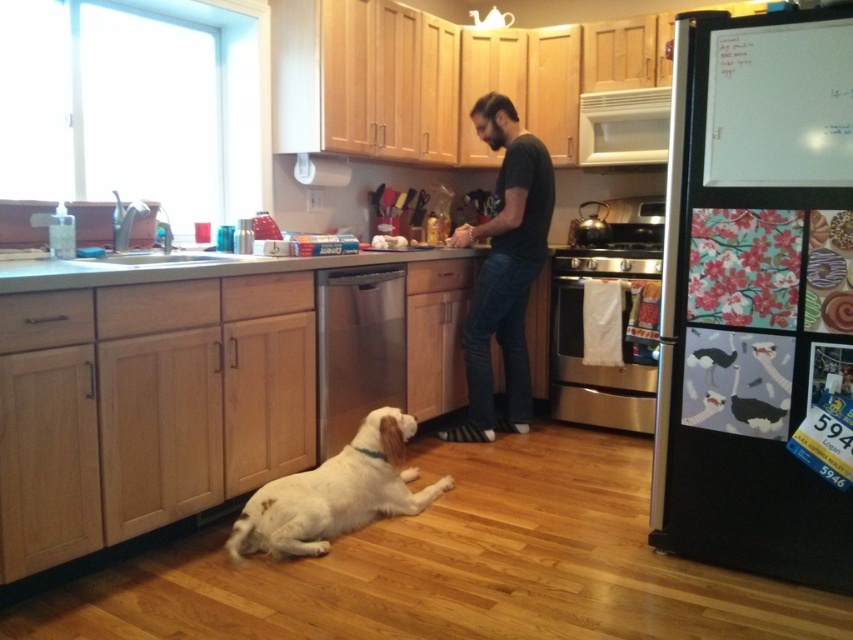
This screenshot has width=853, height=640. Describe the element at coordinates (357, 348) in the screenshot. I see `stainless steel dishwasher at center` at that location.

What do you see at coordinates (357, 348) in the screenshot?
I see `stainless steel dishwasher at center` at bounding box center [357, 348].

This screenshot has width=853, height=640. Identify the location of stainless steel dishwasher at center. (357, 348).

Which is behind, point (384, 486) or point (335, 360)?

The point (335, 360) is more distant.

Does white fur dog at lower center come behind stainless steel dishwasher at center?

No.

Is point (393, 448) more distant than point (366, 394)?

No.

Find the location of a particular element. This screenshot has width=853, height=640. white fur dog at lower center is located at coordinates (335, 493).

Who is positioned more to the right, smooth granite countertop at center or white glossy exhaust hood at upper center?

From the viewer's perspective, white glossy exhaust hood at upper center appears more on the right side.

You are a GUI agent. You are given a task and a screenshot of the screen. Output one action in this format:
    pyautogui.click(x=<x>, y=<y>)
    Task: Click on the smooth granite countertop at center
    The height and width of the screenshot is (640, 853).
    Given the screenshot: What is the action you would take?
    pyautogui.click(x=189, y=266)

Locate an element on the screen. smooth granite countertop at center is located at coordinates (189, 266).

Locate an element on the screen. This screenshot has width=853, height=640. smooth granite countertop at center is located at coordinates (189, 266).